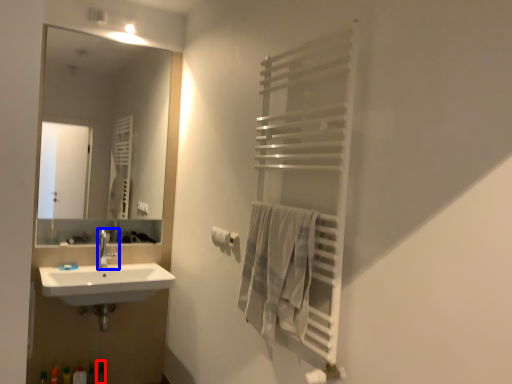
Question: Which of the following is the farthest to the observer, toiletry (highlighted by a red box) or tap (highlighted by a blue box)?

Choices:
 (A) toiletry
 (B) tap

Answer: (B)